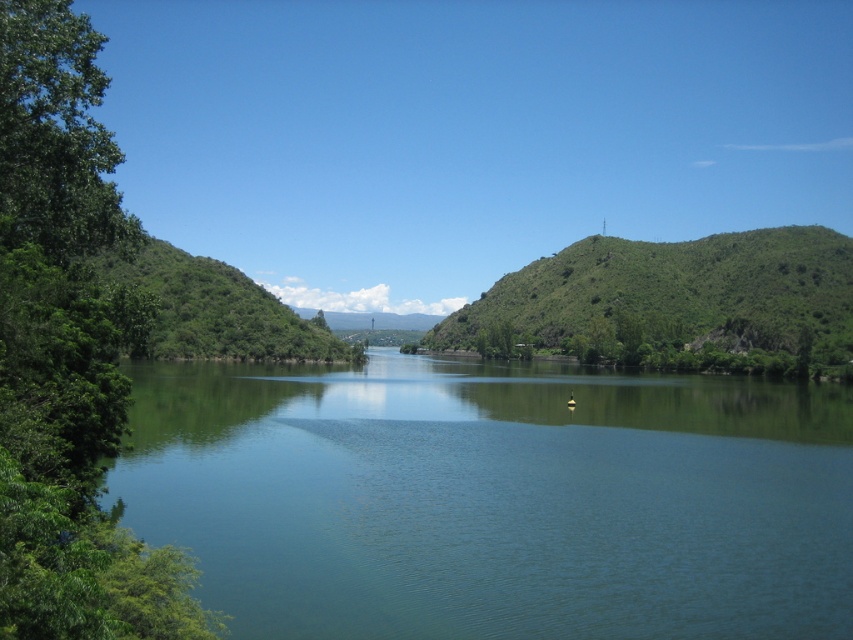
Is green leafy tree at left below green leafy hill at center?

Correct, green leafy tree at left is located below green leafy hill at center.

Does green leafy tree at left appear on the left side of green leafy hill at center?

Correct, you'll find green leafy tree at left to the left of green leafy hill at center.

Image resolution: width=853 pixels, height=640 pixels. Identify the location of green leafy tree at left. (68, 353).

Does green smooth water at center have a lesser width compared to green leafy tree at left?

Incorrect, green smooth water at center's width is not less than green leafy tree at left's.

Describe the element at coordinates (495, 499) in the screenshot. This screenshot has height=640, width=853. I see `green smooth water at center` at that location.

Locate an element on the screen. This screenshot has width=853, height=640. green smooth water at center is located at coordinates (495, 499).

Who is shorter, green smooth water at center or green leafy hill at center?

With less height is green smooth water at center.

Between point (614, 500) and point (634, 317), which one is positioned behind?

Point (634, 317)

Is point (373, 352) positioned behind point (566, 316)?

Yes.

Identify the location of green smooth water at center. This screenshot has width=853, height=640. (495, 499).